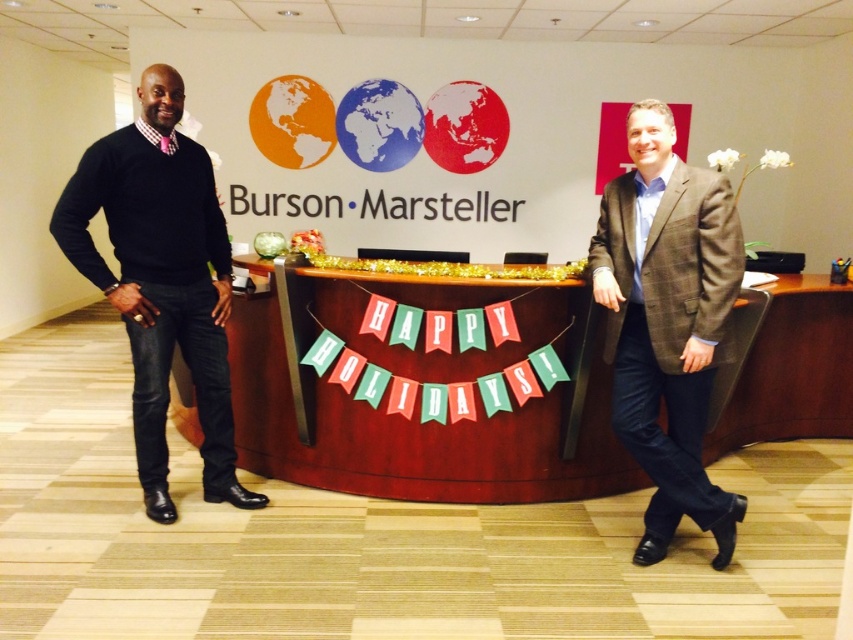
Does brown plaid blazer at center appear on the left side of black sweater at left?

In fact, brown plaid blazer at center is to the right of black sweater at left.

Between point (717, 232) and point (201, 340), which one is positioned in front?

Point (717, 232)

Locate an element on the screen. This screenshot has height=640, width=853. brown plaid blazer at center is located at coordinates coord(666,323).

The height and width of the screenshot is (640, 853). In order to click on brown plaid blazer at center in this screenshot , I will do `click(666, 323)`.

Which is below, red wood desk at center or brown plaid blazer at center?

red wood desk at center is lower down.

Consider the image. Is red wood desk at center bigger than brown plaid blazer at center?

Correct, red wood desk at center is larger in size than brown plaid blazer at center.

Between point (360, 440) and point (697, 259), which one is positioned in front?

Point (697, 259)

Where is `red wood desk at center`? The height and width of the screenshot is (640, 853). red wood desk at center is located at coordinates (416, 400).

Which of these two, red wood desk at center or black sweater at left, stands shorter?

red wood desk at center

This screenshot has width=853, height=640. Find the location of `red wood desk at center`. red wood desk at center is located at coordinates (416, 400).

The image size is (853, 640). What are the coordinates of `red wood desk at center` in the screenshot? It's located at (416, 400).